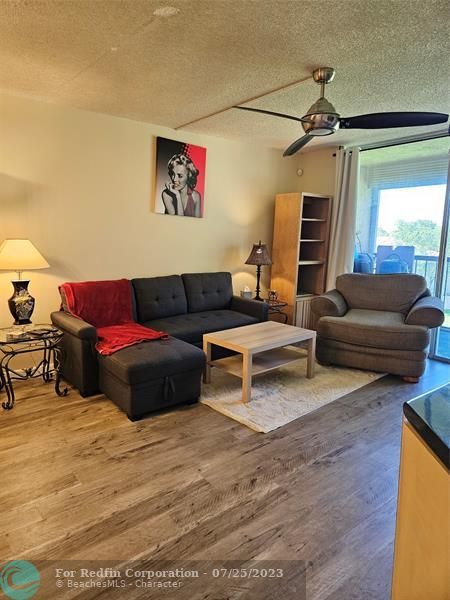
Find the location of `picture`. picture is located at coordinates (176, 181).